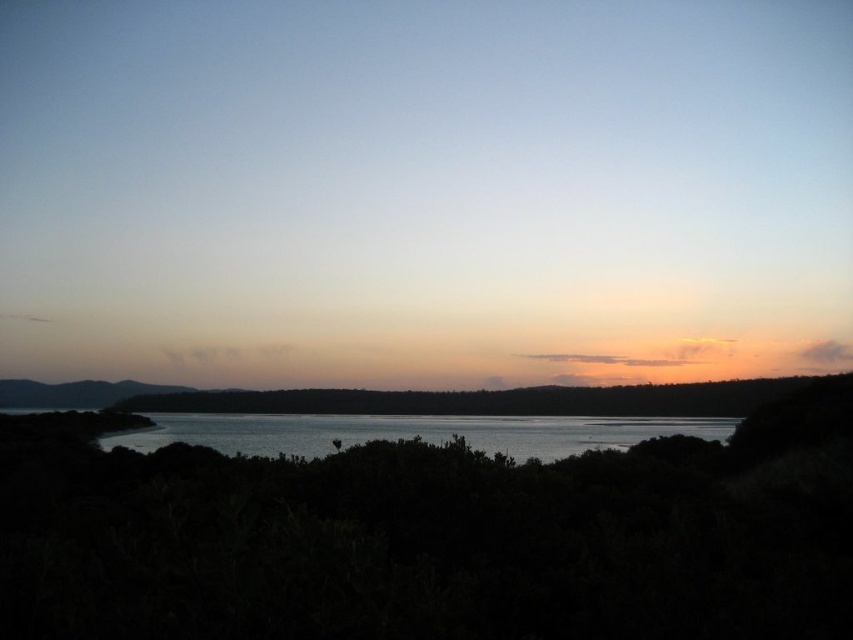
Can you confirm if glistening silver water at center is thinner than matte orange sky at center?

Correct, glistening silver water at center's width is less than matte orange sky at center's.

Does glistening silver water at center have a greater height compared to matte orange sky at center?

Incorrect, glistening silver water at center's height is not larger of matte orange sky at center's.

Which is behind, point (503, 435) or point (198, 397)?

The point (198, 397) is behind.

At what (x,y) coordinates should I click in order to perform the action: click on glistening silver water at center. Please return your answer as a coordinate pair (x, y). The width and height of the screenshot is (853, 640). Looking at the image, I should click on (410, 433).